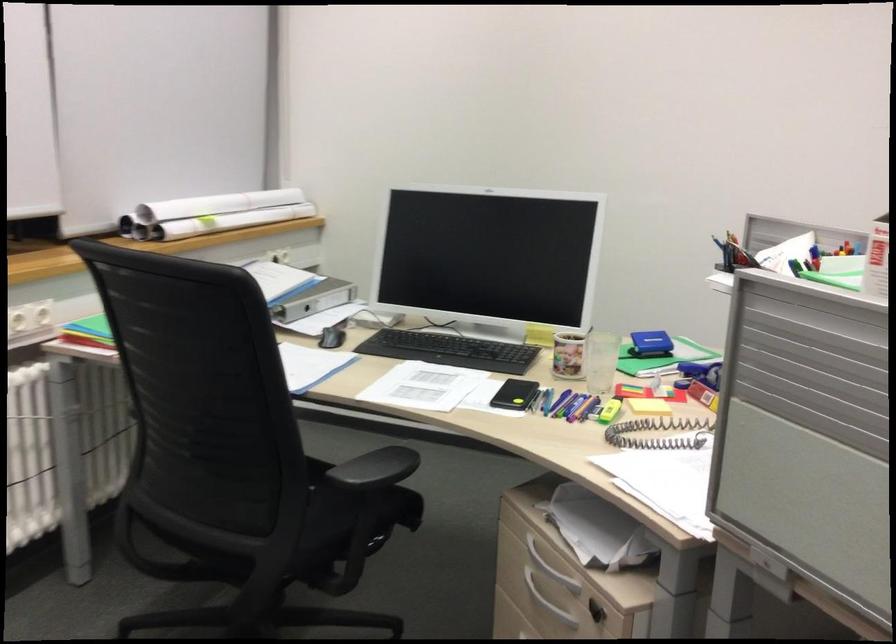
Find where to placing arm the black chair armrest. Please return your answer as a coordinate pair (x, y).

(375, 468)